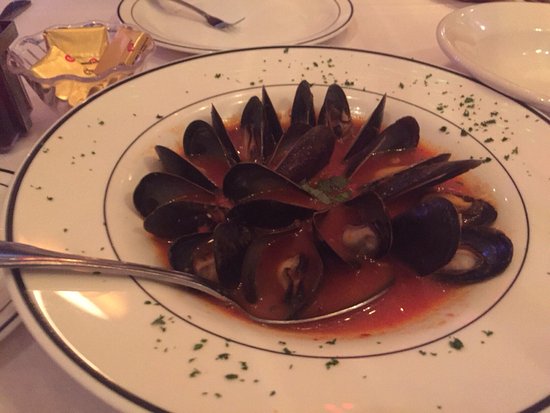
Find the location of `spoon`. spoon is located at coordinates (338, 298).